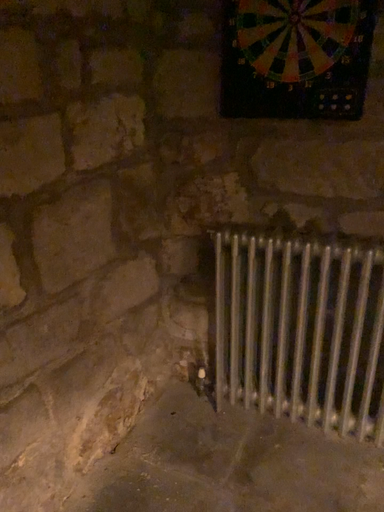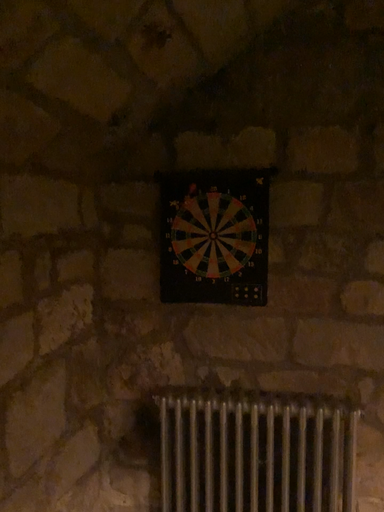
Question: Which way did the camera rotate in the video?

Choices:
 (A) rotated downward
 (B) rotated upward

Answer: (B)